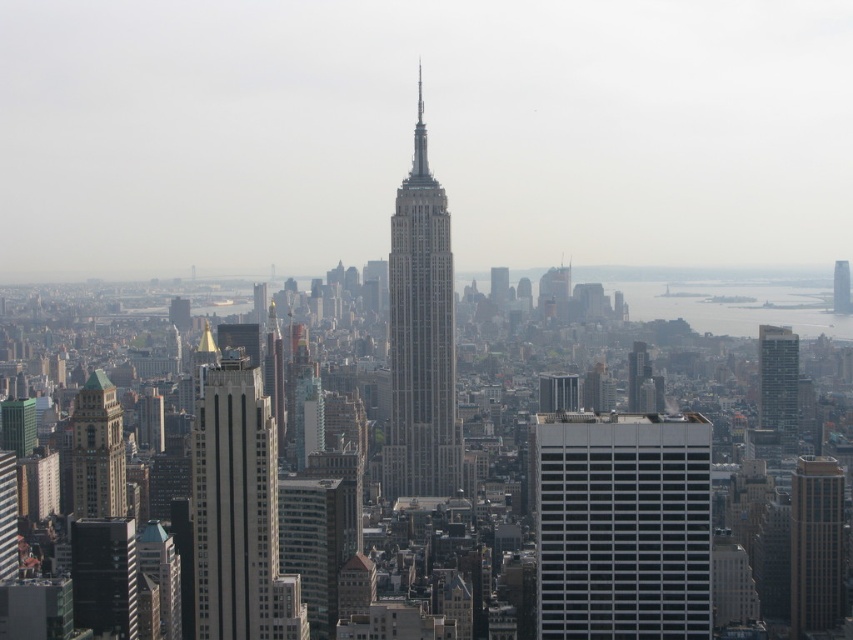
Question: Among these points, which one is nearest to the camera?

Choices:
 (A) (805, 525)
 (B) (74, 406)
 (C) (843, 275)
 (D) (390, 336)

Answer: (D)

Question: Which point appears closest to the camera in this image?

Choices:
 (A) [688, 474]
 (B) [492, 285]

Answer: (B)

Question: Is green marble tower at lower left smaller than glassy reflective skyscraper at right?

Choices:
 (A) no
 (B) yes

Answer: (A)

Question: Does white glass building at center appear over smooth glass skyscraper at center?

Choices:
 (A) yes
 (B) no

Answer: (B)

Question: Does white marble tower at center lie in front of brown brick building at center-right?

Choices:
 (A) no
 (B) yes

Answer: (B)

Question: Which object is the closest to the glassy reflective skyscraper at right?

Choices:
 (A) white glass building at center
 (B) brown brick building at center-right

Answer: (B)